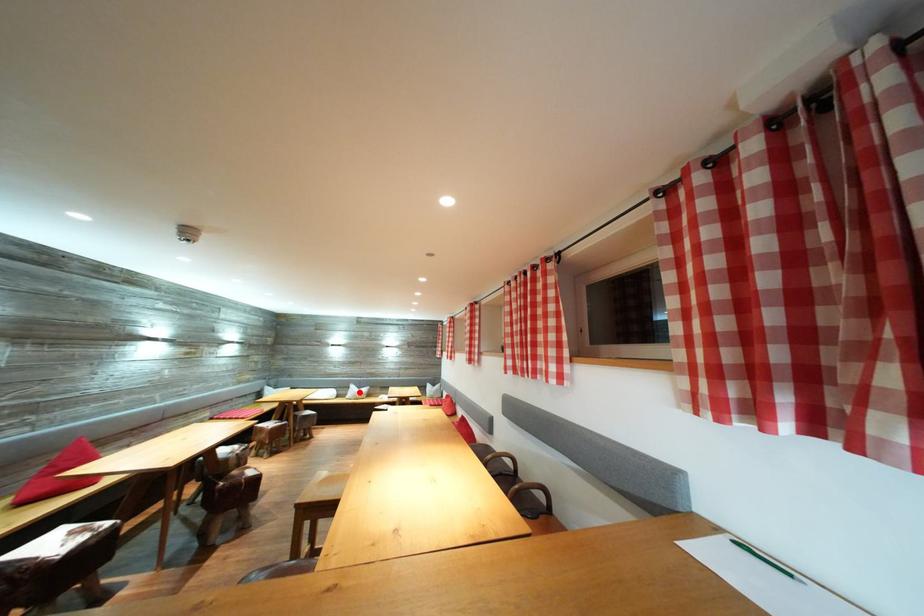
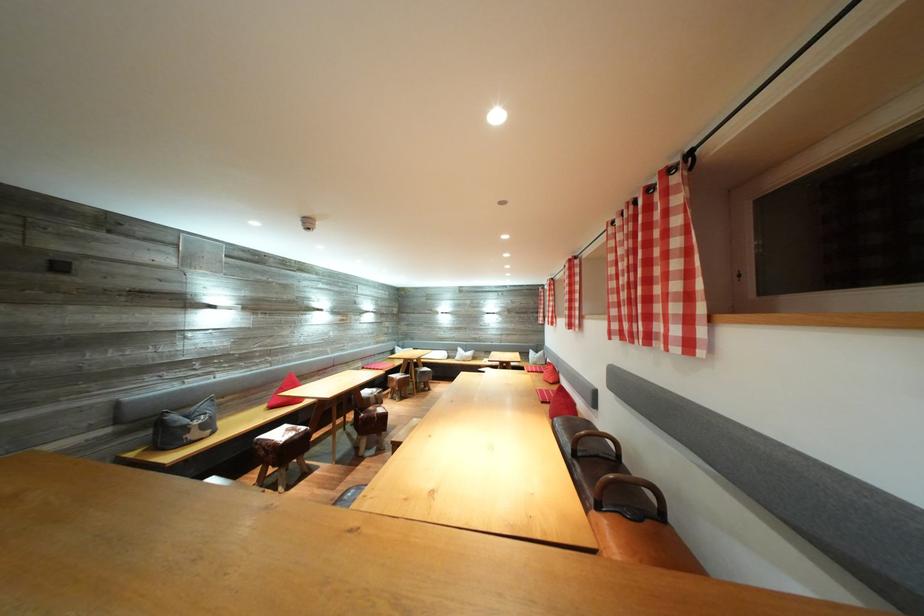
Question: I am providing you with two images of the same scene from different viewpoints. Given a red point in image1, look at the same physical point in image2. Is it:

Choices:
 (A) Closer to the viewpoint
 (B) Farther from the viewpoint

Answer: (A)